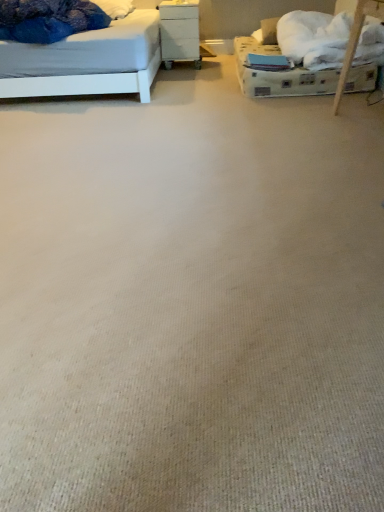
What is the approximate width of white glossy nightstand at center?

It is 20.76 inches.

Image resolution: width=384 pixels, height=512 pixels. Identify the location of white glossy nightstand at center. (179, 32).

What do you see at coordinates (179, 32) in the screenshot?
I see `white glossy nightstand at center` at bounding box center [179, 32].

The image size is (384, 512). Find the location of `white glossy nightstand at center`. white glossy nightstand at center is located at coordinates (179, 32).